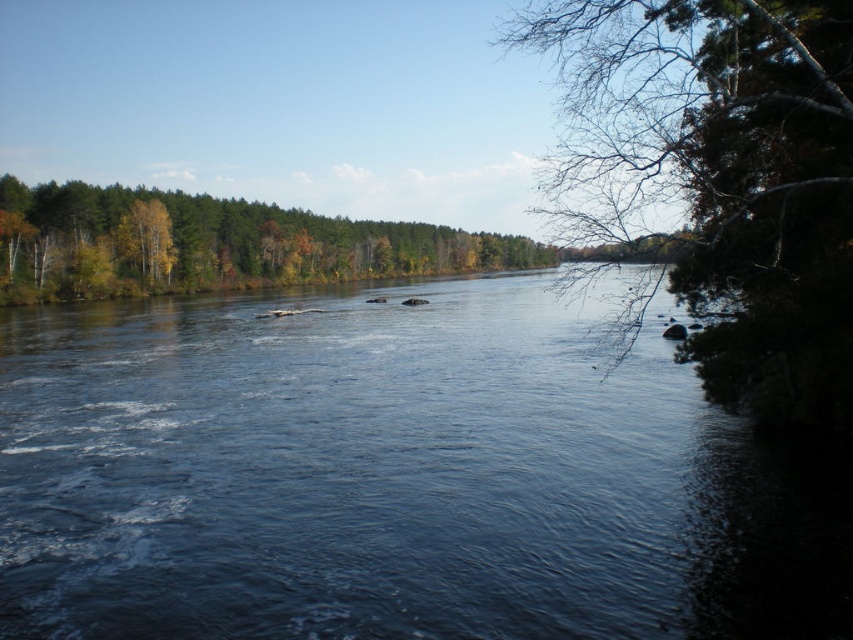
You are standing at the edge of the river in the serene autumn scene. You notice two points marked in the image. Which point, point (370, 330) or point (155, 212), is closer to you?

Point (370, 330) is closer to the camera than point (155, 212), so it is closer to you.